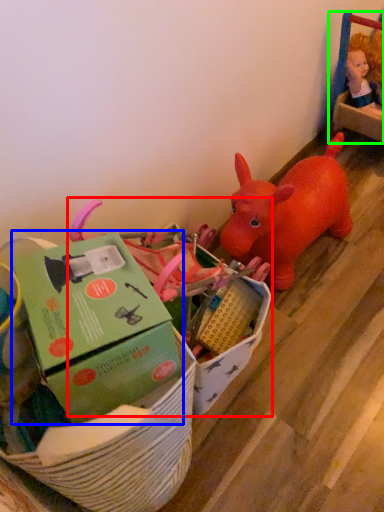
Question: Which is farther away from toy (highlighted by a red box)? box (highlighted by a blue box) or toy (highlighted by a green box)?

Choices:
 (A) box
 (B) toy

Answer: (B)